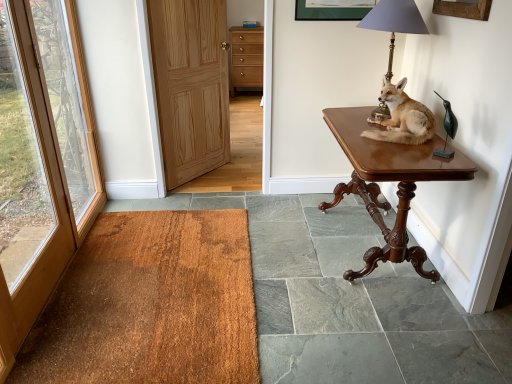
This screenshot has height=384, width=512. What are the coordinates of `free spot to the left of brown wood table at right` in the screenshot? It's located at (286, 240).